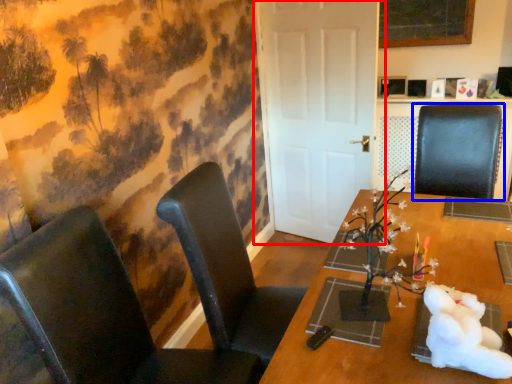
Question: Which point is further to the camera, door (highlighted by a red box) or chair (highlighted by a blue box)?

Choices:
 (A) door
 (B) chair

Answer: (A)